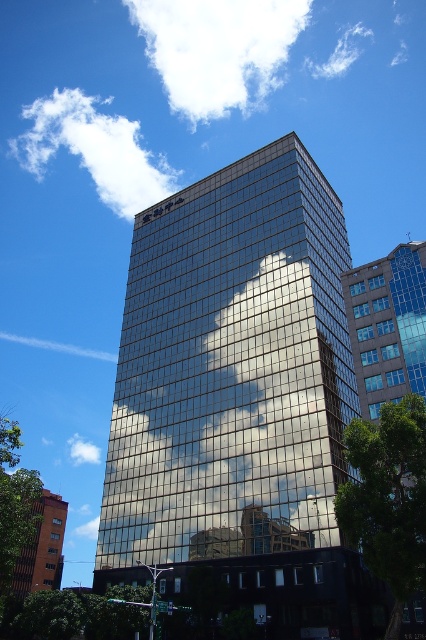
You are an architect analyzing the image of the two buildings. Based on the white fluffy cloud at upper center and the orange brick building at lower left, which one has a greater horizontal span when viewed from your current position?

The white fluffy cloud at upper center has a greater horizontal span than the orange brick building at lower left because its width is larger than the building.

You are an architect analyzing the image of two buildings. You notice the white fluffy cloud at upper left and the orange brick building at lower left. Which one has a greater width?

The white fluffy cloud at upper left has a greater width than the orange brick building at lower left.

You are an architect analyzing the spatial relationship between the orange brick building at lower left and the white fluffy cloud at upper left. Which object is positioned closer to the viewer?

The white fluffy cloud at upper left is closer to the viewer because the orange brick building at lower left is behind it.